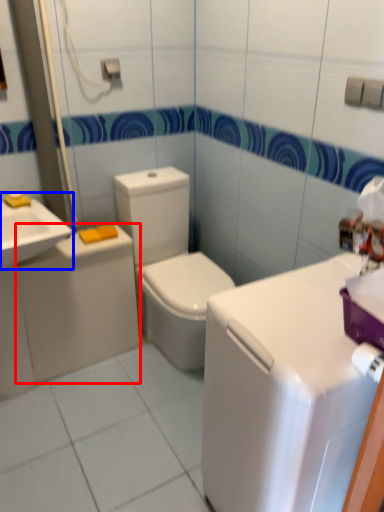
Question: Among these objects, which one is farthest to the camera, appliance (highlighted by a red box) or sink (highlighted by a blue box)?

Choices:
 (A) appliance
 (B) sink

Answer: (A)